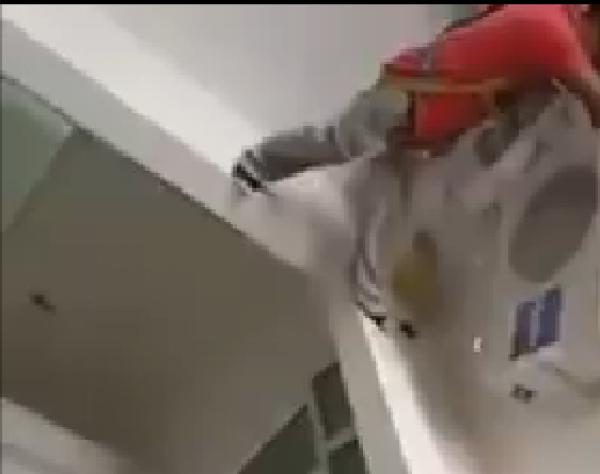
This screenshot has width=600, height=474. Find the location of `washing machine`. washing machine is located at coordinates (584, 315).